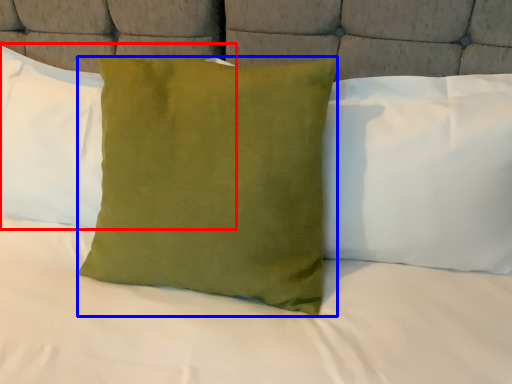
Question: Among these objects, which one is nearest to the camera, pillow (highlighted by a red box) or pillow (highlighted by a blue box)?

Choices:
 (A) pillow
 (B) pillow

Answer: (B)